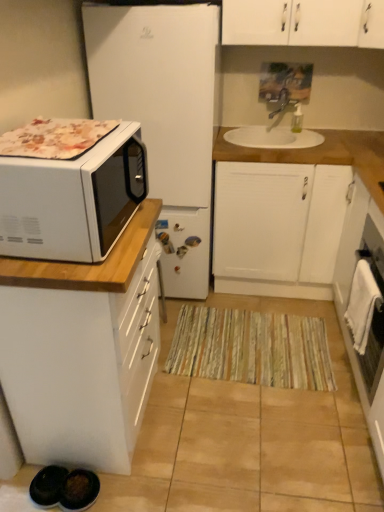
Describe the element at coordinates (373, 309) in the screenshot. Image resolution: width=384 pixels, height=512 pixels. I see `white glossy oven at right` at that location.

Identify the location of white glossy oven at right. (373, 309).

What is the approximate height of striped fabric doormat at center?

The height of striped fabric doormat at center is 1.28 inches.

The width and height of the screenshot is (384, 512). Describe the element at coordinates (165, 117) in the screenshot. I see `white matte refrigerator at left` at that location.

What do you see at coordinates (273, 138) in the screenshot?
I see `white ceramic sink at upper center` at bounding box center [273, 138].

You are a GUI agent. You are given a task and a screenshot of the screen. Output one action in this format:
    pyautogui.click(x=<x>, y=<y>)
    Task: Click on the white glossy microwave at left, placed as the second cabinetry when sorted from back to front
    This screenshot has height=512, width=384.
    Given the screenshot: What is the action you would take?
    pyautogui.click(x=80, y=351)

The height and width of the screenshot is (512, 384). What do you see at coordinates (80, 351) in the screenshot? I see `white glossy microwave at left, the 1th cabinetry when ordered from front to back` at bounding box center [80, 351].

You are a GUI agent. You are given a task and a screenshot of the screen. Output one action in this format:
    pyautogui.click(x=<x>, y=<y>)
    Task: Click on the white glossy microwave at left
    This screenshot has width=384, height=512.
    Given the screenshot: What is the action you would take?
    pyautogui.click(x=73, y=199)

You are a GUI agent. You are given a task and a screenshot of the screen. Output one action in this format:
    pyautogui.click(x=<x>, y=<y>)
    Task: Click on the white glossy oven at right
    Image resolution: width=384 pixels, height=512 pixels.
    Given the screenshot: What is the action you would take?
    pyautogui.click(x=373, y=309)

Which is in front, white matte cabinet at center, the second cabinetry viewed from the left, or white ceramic sink at upper center?

white matte cabinet at center, the second cabinetry viewed from the left, is closer to the camera.

In the scene shown: From a real-world perspective, which object rests below the other?

In real-world perspective, white matte cabinet at center, the first cabinetry in the right-to-left sequence, is lower.

Is point (292, 169) positioned after point (274, 142)?

That is False.

Does white matte cabinet at center, the first cabinetry in the right-to-left sequence, have a lesser height compared to white ceramic sink at upper center?

No, white matte cabinet at center, the first cabinetry in the right-to-left sequence, is not shorter than white ceramic sink at upper center.

Looking at this image, is white matte refrigerator at left in contact with white glossy oven at right?

No.

Can you confirm if white matte refrigerator at left is thinner than white glossy oven at right?

No, white matte refrigerator at left is not thinner than white glossy oven at right.

From a real-world perspective, which is physically below, white matte refrigerator at left or white glossy oven at right?

In real-world perspective, white glossy oven at right is lower.

I want to click on refrigerator above the white glossy oven at right (from a real-world perspective), so click(165, 117).

Between white glossy oven at right and white matte cabinet at center, the 2th cabinetry in the front-to-back sequence, which one has larger size?

white matte cabinet at center, the 2th cabinetry in the front-to-back sequence, is bigger.

How different are the orientations of white glossy oven at right and white matte cabinet at center, the first cabinetry in the right-to-left sequence, in degrees?

The angle between the facing direction of white glossy oven at right and the facing direction of white matte cabinet at center, the first cabinetry in the right-to-left sequence, is 88.7 degrees.

Which object is closer to the camera taking this photo, white glossy oven at right or white matte cabinet at center, the second cabinetry viewed from the left?

white glossy oven at right is closer to the camera.

Which object is wider, white glossy oven at right or white glossy microwave at left?

With larger width is white glossy microwave at left.

From the image's perspective, is white glossy oven at right above or below white glossy microwave at left?

Clearly, from the image's perspective, white glossy oven at right is below white glossy microwave at left.

Who is shorter, white glossy oven at right or white glossy microwave at left?

white glossy microwave at left.

Between white glossy oven at right and white glossy microwave at left, which one is positioned behind?

white glossy oven at right is more distant.

Based on the photo, is white ceramic sink at upper center not close to white glossy oven at right?

No, white ceramic sink at upper center is not far from white glossy oven at right.

Considering the positions of objects white ceramic sink at upper center and white glossy oven at right in the image provided, who is more to the right, white ceramic sink at upper center or white glossy oven at right?

Positioned to the right is white glossy oven at right.

Is white ceramic sink at upper center shorter than white glossy oven at right?

Yes.

Looking at this image, which object is wider, white ceramic sink at upper center or white glossy oven at right?

white ceramic sink at upper center is wider.

Are white matte cabinet at center, the second cabinetry viewed from the left, and white matte refrigerator at left making contact?

white matte cabinet at center, the second cabinetry viewed from the left, is not next to white matte refrigerator at left, and they're not touching.

From the picture: From a real-world perspective, is white matte cabinet at center, the first cabinetry in the right-to-left sequence, over white matte refrigerator at left?

No, from a real-world perspective, white matte cabinet at center, the first cabinetry in the right-to-left sequence, is not over white matte refrigerator at left

From the image's perspective, is white matte cabinet at center, the second cabinetry viewed from the left, over white matte refrigerator at left?

No.

Which of these two, white glossy microwave at left, which is the second cabinetry in right-to-left order, or white glossy microwave at left, is smaller?

With smaller size is white glossy microwave at left.

Which object is positioned more to the right, white glossy microwave at left, positioned as the 1th cabinetry in left-to-right order, or white glossy microwave at left?

From the viewer's perspective, white glossy microwave at left appears more on the right side.

What are the coordinates of `microwave oven located in front of the white glossy microwave at left, positioned as the 1th cabinetry in left-to-right order` in the screenshot? It's located at (73, 199).

Between point (25, 369) and point (31, 165), which one is positioned behind?

The point (25, 369) is more distant.

Where is `sink on the left of white matte cabinet at center, the second cabinetry viewed from the left`? This screenshot has height=512, width=384. sink on the left of white matte cabinet at center, the second cabinetry viewed from the left is located at coordinates (273, 138).

I want to click on oven on the right of white matte refrigerator at left, so (x=373, y=309).

When comparing their distances from white glossy microwave at left, does striped fabric doormat at center or white matte cabinet at center, the first cabinetry from the back, seem closer?

white matte cabinet at center, the first cabinetry from the back.

From the image, which object appears to be farther from white glossy microwave at left, white matte cabinet at center, the second cabinetry viewed from the left, or striped fabric doormat at center?

Based on the image, striped fabric doormat at center appears to be further to white glossy microwave at left.

Considering their positions, is white matte cabinet at center, the first cabinetry in the right-to-left sequence, positioned further to white matte refrigerator at left than white glossy microwave at left, positioned as the 1th cabinetry in left-to-right order?

white glossy microwave at left, positioned as the 1th cabinetry in left-to-right order, is further to white matte refrigerator at left.

Which object lies further to the anchor point white matte cabinet at center, the first cabinetry from the back, white glossy oven at right or white glossy microwave at left, placed as the second cabinetry when sorted from back to front?

Answer: white glossy microwave at left, placed as the second cabinetry when sorted from back to front, is positioned further to the anchor white matte cabinet at center, the first cabinetry from the back.

Based on their spatial positions, is white glossy microwave at left, placed as the second cabinetry when sorted from back to front, or white matte refrigerator at left further from striped fabric doormat at center?

white matte refrigerator at left is positioned further to the anchor striped fabric doormat at center.

Looking at the image, which one is located further to white glossy oven at right, white matte refrigerator at left or white ceramic sink at upper center?

white matte refrigerator at left.

Based on their spatial positions, is white glossy microwave at left or white matte cabinet at center, the 2th cabinetry in the front-to-back sequence, further from white glossy microwave at left, placed as the second cabinetry when sorted from back to front?

white matte cabinet at center, the 2th cabinetry in the front-to-back sequence, is positioned further to the anchor white glossy microwave at left, placed as the second cabinetry when sorted from back to front.

When comparing their distances from white glossy microwave at left, does white matte refrigerator at left or white matte cabinet at center, the second cabinetry viewed from the left, seem further?

Based on the image, white matte cabinet at center, the second cabinetry viewed from the left, appears to be further to white glossy microwave at left.

Identify the location of microwave oven between white glossy microwave at left, placed as the second cabinetry when sorted from back to front, and white glossy oven at right. This screenshot has height=512, width=384. (73, 199).

What are the coordinates of `doormat between white glossy microwave at left, placed as the second cabinetry when sorted from back to front, and white glossy oven at right, in the horizontal direction` in the screenshot? It's located at (251, 348).

Identify the location of oven that lies between white matte refrigerator at left and striped fabric doormat at center from top to bottom. (373, 309).

Where is `doormat between white glossy microwave at left and white ceramic sink at upper center in the front-back direction`? The height and width of the screenshot is (512, 384). doormat between white glossy microwave at left and white ceramic sink at upper center in the front-back direction is located at coordinates (251, 348).